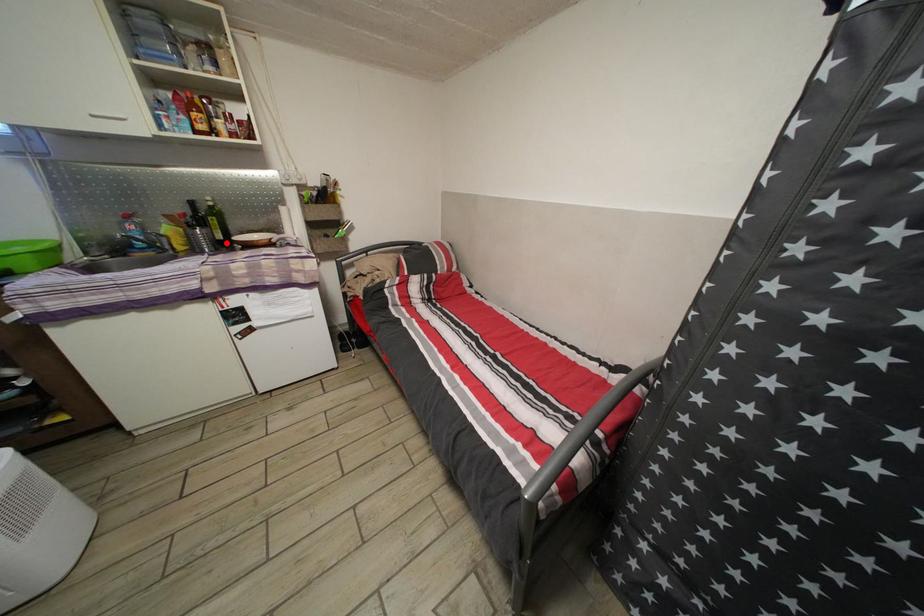
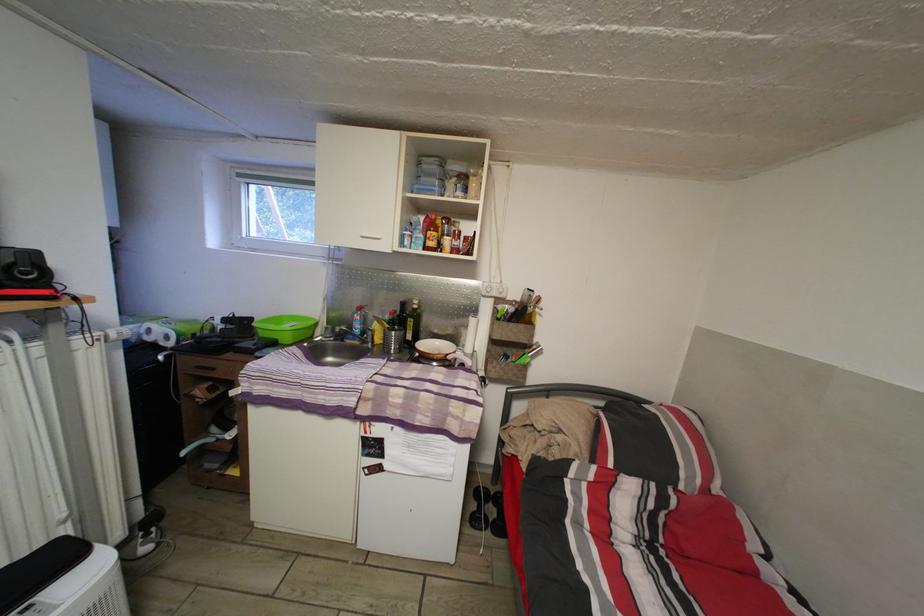
In the second image, find the point that corresponds to the highlighted location in the first image.

(417, 344)